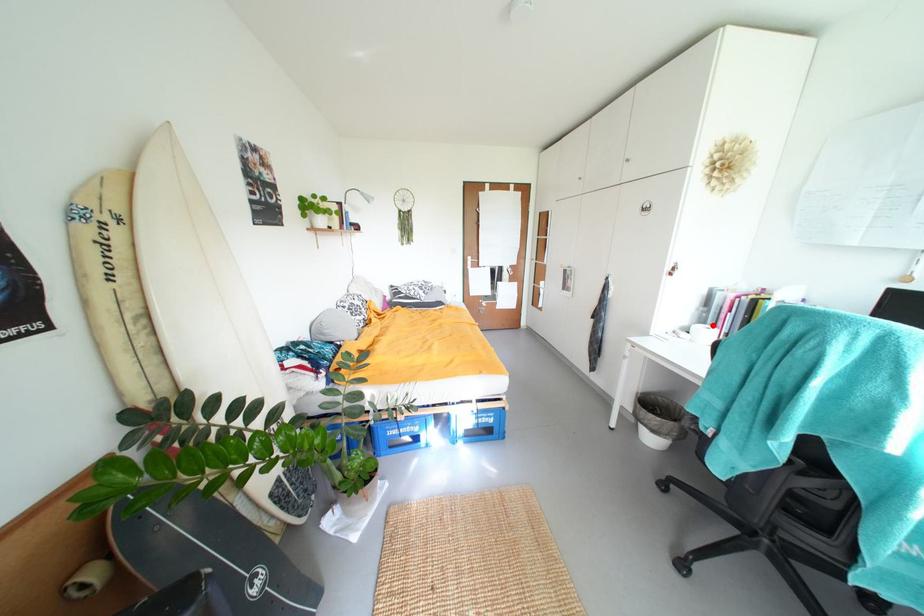
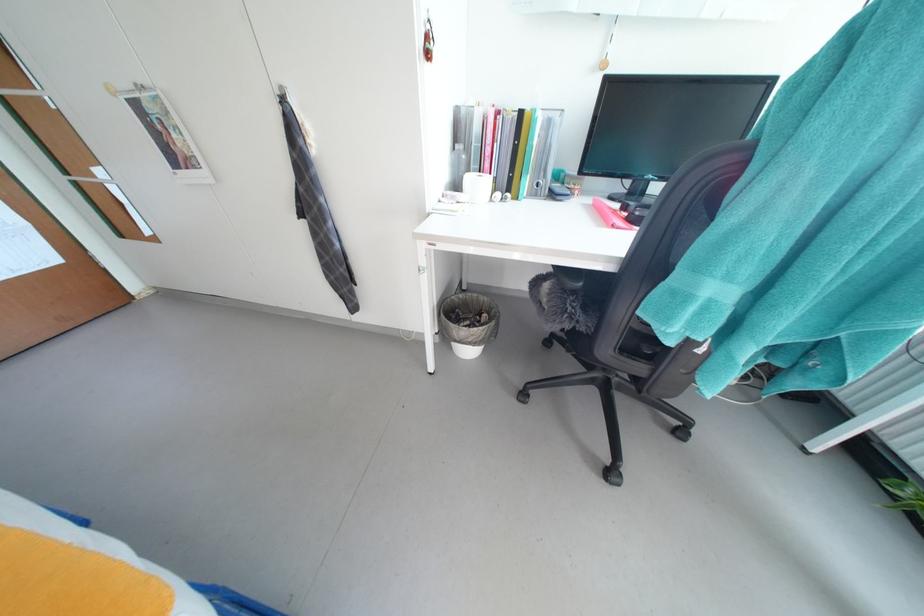
Where in the second image is the point corresponding to the highlighted location from the first image?

(477, 172)